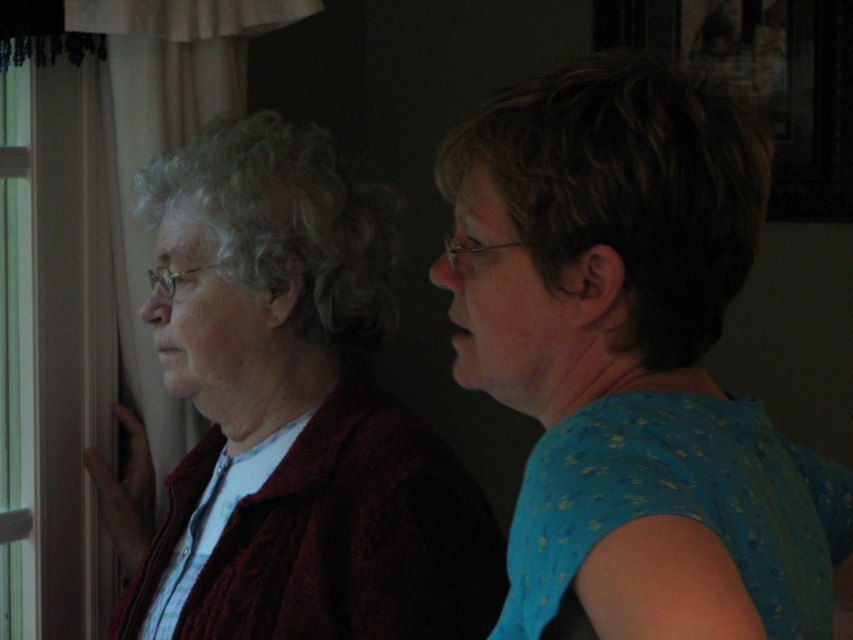
Is blue dotted blouse at right bigger than transparent glass window at left?

Correct, blue dotted blouse at right is larger in size than transparent glass window at left.

Does blue dotted blouse at right appear on the left side of transparent glass window at left?

Incorrect, blue dotted blouse at right is not on the left side of transparent glass window at left.

Who is more forward, (804, 570) or (18, 612)?

Positioned in front is point (804, 570).

Where is `blue dotted blouse at right`? This screenshot has height=640, width=853. blue dotted blouse at right is located at coordinates (633, 362).

Can you confirm if knitted maroon sweater at left is positioned below transparent glass window at left?

Yes.

Does knitted maroon sweater at left have a larger size compared to transparent glass window at left?

Yes, knitted maroon sweater at left is bigger than transparent glass window at left.

The width and height of the screenshot is (853, 640). Identify the location of knitted maroon sweater at left. pyautogui.click(x=292, y=410).

Is point (843, 588) farther from camera compared to point (376, 225)?

No, it is not.

Can you confirm if blue dotted blouse at right is shorter than knitted maroon sweater at left?

Correct, blue dotted blouse at right is not as tall as knitted maroon sweater at left.

In order to click on blue dotted blouse at right in this screenshot , I will do `click(633, 362)`.